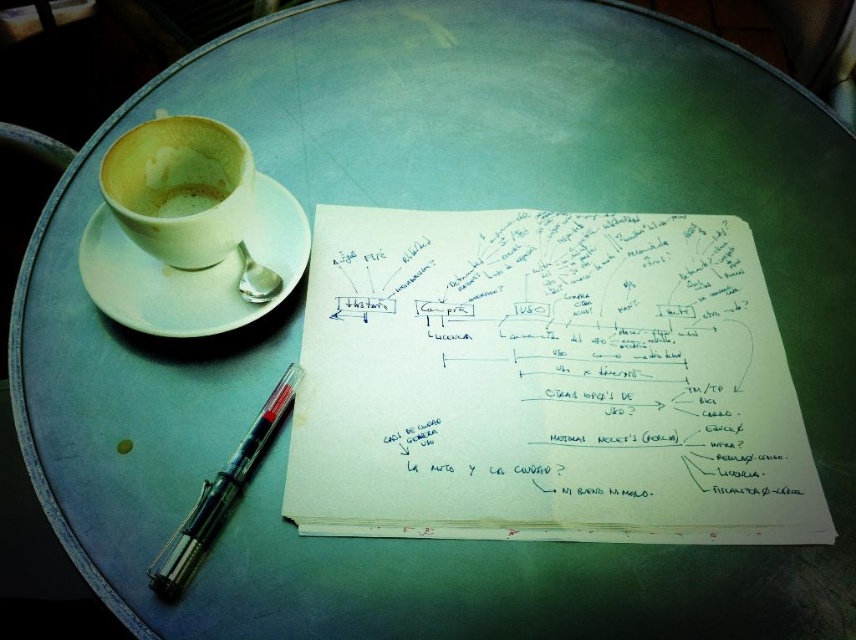
Question: Is white paper at center to the left of black metallic pen at lower left from the viewer's perspective?

Choices:
 (A) yes
 (B) no

Answer: (B)

Question: Which object appears farthest from the camera in this image?

Choices:
 (A) light brown paper cup at left
 (B) white paper at center
 (C) white ceramic saucer at upper left

Answer: (A)

Question: Which point appears closest to the camera in this image?

Choices:
 (A) (726, 424)
 (B) (218, 260)

Answer: (A)

Question: Is white paper at center closer to the viewer compared to black metallic pen at lower left?

Choices:
 (A) yes
 (B) no

Answer: (B)

Question: Which of the following is the farthest from the observer?

Choices:
 (A) (434, 388)
 (B) (170, 205)
 (C) (128, 314)
 (D) (217, 472)

Answer: (B)

Question: Is black metallic pen at lower left to the left of light brown paper cup at left from the viewer's perspective?

Choices:
 (A) no
 (B) yes

Answer: (A)